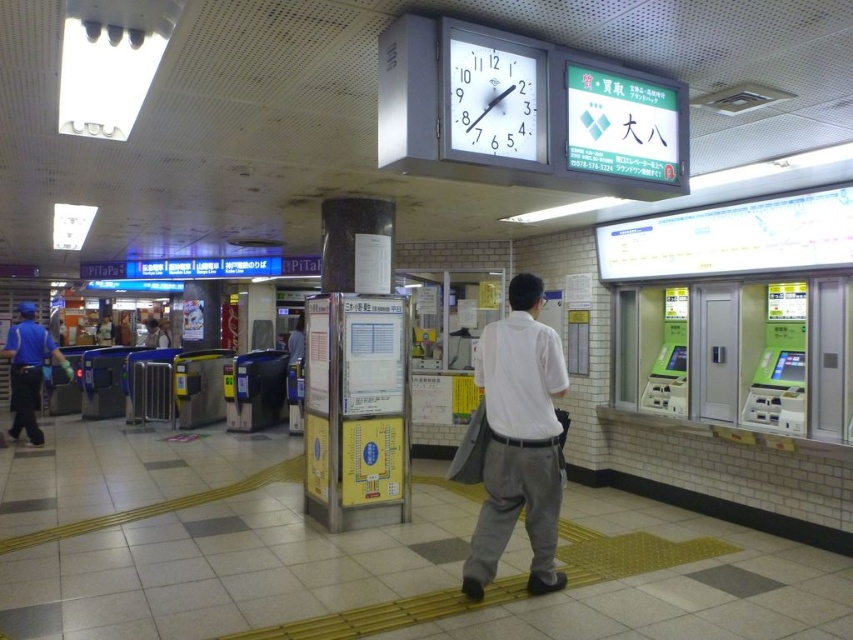
You are standing at the point labeled point (492, 104) in the train station. You want to walk to the point labeled point (15, 324). Which direction should you move relative to your current position?

You should move towards the lower right direction because point (15, 324) is further away from the viewer compared to point (492, 104).

You are standing at the point marked as point (x=519, y=440) in the train station. What object is located exactly at this point?

The white cotton shirt at center is located exactly at point (x=519, y=440).

You are a passenger waiting for your train at the train station. You notice a white glossy clock at upper center and a blue uniform at left. Which object is shorter in height?

The white glossy clock at upper center is shorter in height compared to the blue uniform at left.